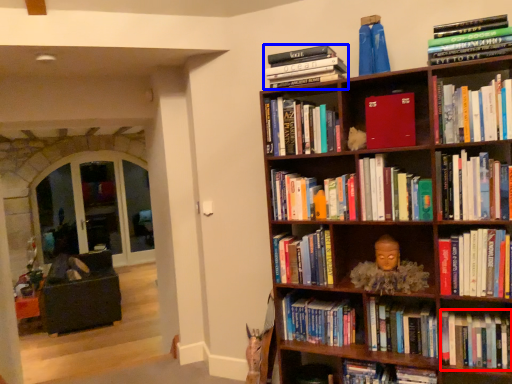
Question: Which object appears closest to the camera in this image, book (highlighted by a red box) or book (highlighted by a blue box)?

Choices:
 (A) book
 (B) book

Answer: (A)